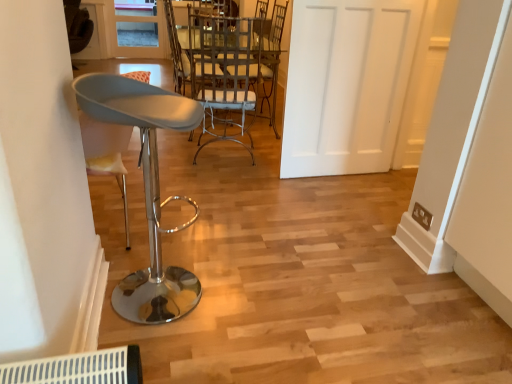
At what (x,y) coordinates should I click in order to perform the action: click on empty space that is to the right of matte gray stool at left, which appears as the first chair when viewed from the front. Please return your answer as a coordinate pair (x, y). Looking at the image, I should click on (241, 301).